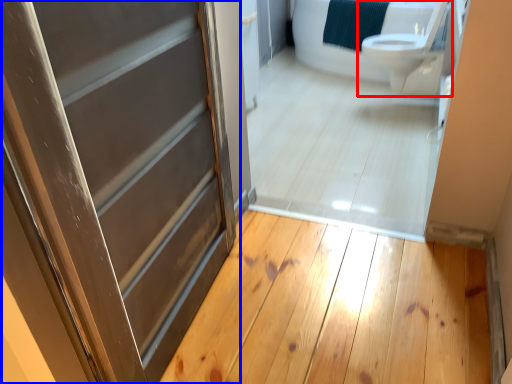
Question: Which object appears farthest to the camera in this image, toilet (highlighted by a red box) or door (highlighted by a blue box)?

Choices:
 (A) toilet
 (B) door

Answer: (A)